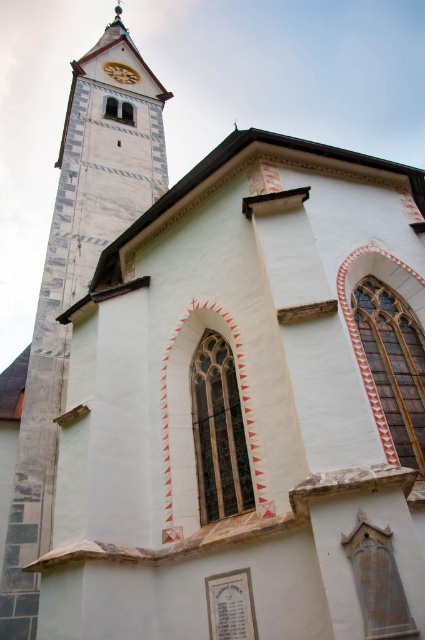
You are standing in front of the church and notice a point marked at coordinates (76, 282). Which architectural feature of the church does this point correspond to?

The point at (76, 282) corresponds to the speckled stone tower at left.

You are standing in front of the historic church and want to take a photo of both the speckled stone tower at left and the wooden clock face at upper center. Which object should you focus on first to ensure both are in the frame?

You should focus on the speckled stone tower at left first because it is closer to you than the wooden clock face at upper center, ensuring both will be in the frame when properly focused.

You are standing in front of the historic church and want to take a photo of the speckled stone tower at left. If your camera can focus on objects up to 40 meters away, will you need to move closer to capture a clear image?

The speckled stone tower at left is 41.00 meters away from camera, so you need to move closer to ensure the camera can focus properly.